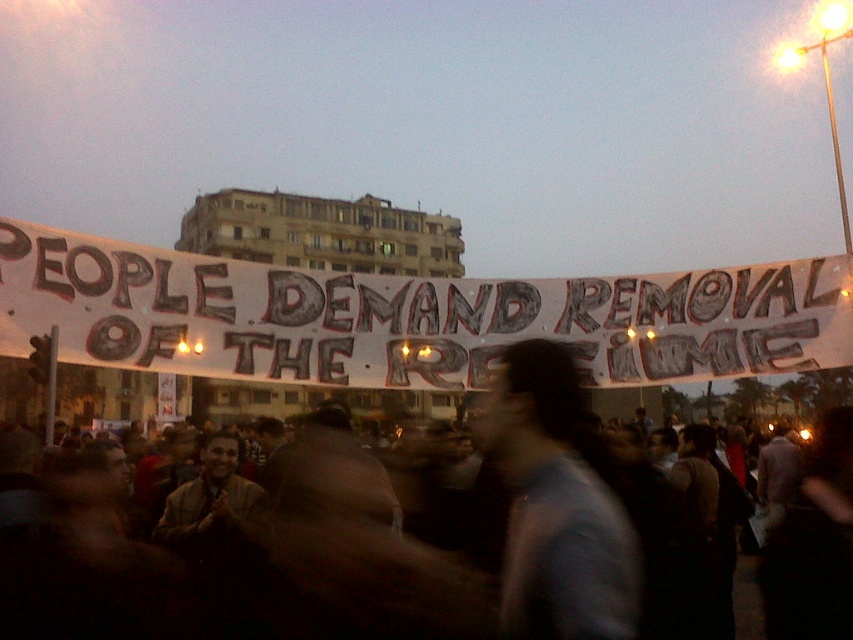
Question: Can you confirm if white paper banner at center is positioned to the left of black fabric crowd at center?

Choices:
 (A) yes
 (B) no

Answer: (A)

Question: Can you confirm if white paper banner at center is smaller than black fabric crowd at center?

Choices:
 (A) yes
 (B) no

Answer: (A)

Question: Based on their relative distances, which object is nearer to the white paper banner at center?

Choices:
 (A) gray matte shirt at center
 (B) black fabric crowd at center

Answer: (A)

Question: Among these points, which one is farthest from the camera?

Choices:
 (A) (84, 298)
 (B) (637, 576)
 (C) (842, 433)

Answer: (C)

Question: Is white paper banner at center thinner than gray matte shirt at center?

Choices:
 (A) no
 (B) yes

Answer: (A)

Question: Which object is farther from the camera taking this photo?

Choices:
 (A) white paper banner at center
 (B) black fabric crowd at center
 (C) gray matte shirt at center

Answer: (B)